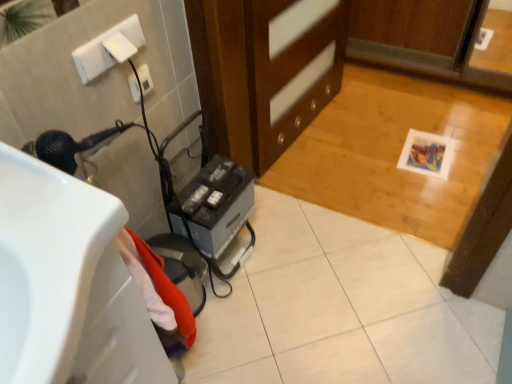
What do you see at coordinates (217, 204) in the screenshot? I see `metallic gray hair dryer at lower left` at bounding box center [217, 204].

You are a GUI agent. You are given a task and a screenshot of the screen. Output one action in this format:
    pyautogui.click(x=<x>, y=<y>)
    Task: Click on the metallic gray hair dryer at lower left
    The width and height of the screenshot is (512, 384).
    Given the screenshot: What is the action you would take?
    click(x=217, y=204)

In the image, is white plastic electric outlet at upper left positioned in front of or behind wooden cabinet at center?

Clearly, white plastic electric outlet at upper left is in front of wooden cabinet at center.

Considering the sizes of white plastic electric outlet at upper left and wooden cabinet at center in the image, is white plastic electric outlet at upper left wider or thinner than wooden cabinet at center?

Considering their sizes, white plastic electric outlet at upper left looks slimmer than wooden cabinet at center.

Considering the positions of point (141, 65) and point (244, 16), is point (141, 65) closer or farther from the camera than point (244, 16)?

Point (141, 65) is closer to the camera than point (244, 16).

How much distance is there between white plastic electric outlet at upper left and wooden cabinet at center?

white plastic electric outlet at upper left is 22.86 inches away from wooden cabinet at center.

From a real-world perspective, is white plastic electric outlet at upper left positioned above or below white glossy sink at lower left?

In terms of real-world spatial position, white plastic electric outlet at upper left is below white glossy sink at lower left.

Which point is more distant from viewer, [135,99] or [58,332]?

Positioned behind is point [135,99].

Which of these two, white plastic electric outlet at upper left or white glossy sink at lower left, is thinner?

white plastic electric outlet at upper left is thinner.

At what (x,y) coordinates should I click in order to perform the action: click on sink located on the left of white plastic electric outlet at upper left. Please return your answer as a coordinate pair (x, y). The width and height of the screenshot is (512, 384). Looking at the image, I should click on (68, 284).

Is metallic gray hair dryer at lower left looking in the opposite direction of white glossy sink at lower left?

No.

Which object is more forward, metallic gray hair dryer at lower left or white glossy sink at lower left?

white glossy sink at lower left is in front.

Between point (240, 175) and point (118, 263), which one is positioned in front?

Point (118, 263)

How much distance is there between metallic gray hair dryer at lower left and white glossy sink at lower left?

metallic gray hair dryer at lower left is 21.54 inches away from white glossy sink at lower left.

Which object is positioned more to the left, wooden cabinet at center or metallic gray hair dryer at lower left?

Positioned to the left is metallic gray hair dryer at lower left.

Does wooden cabinet at center touch metallic gray hair dryer at lower left?

No, wooden cabinet at center is not beside metallic gray hair dryer at lower left.

From the picture: From the image's perspective, is wooden cabinet at center above metallic gray hair dryer at lower left?

Correct, wooden cabinet at center appears higher than metallic gray hair dryer at lower left in the image.

Based on the photo, from the image's perspective, which is below, white glossy sink at lower left or metallic gray hair dryer at lower left?

white glossy sink at lower left is shown below in the image.

Looking at the image, does white glossy sink at lower left seem bigger or smaller compared to metallic gray hair dryer at lower left?

Considering their sizes, white glossy sink at lower left takes up more space than metallic gray hair dryer at lower left.

Does white glossy sink at lower left turn towards metallic gray hair dryer at lower left?

No, white glossy sink at lower left is not oriented towards metallic gray hair dryer at lower left.

Does white glossy sink at lower left contain metallic gray hair dryer at lower left?

No, white glossy sink at lower left does not contain metallic gray hair dryer at lower left.

Looking at this image, which is nearer, [10,372] or [335,36]?

Clearly, point [10,372] is closer to the camera than point [335,36].

From the image's perspective, which object appears higher, white glossy sink at lower left or wooden cabinet at center?

wooden cabinet at center.

Who is bigger, white glossy sink at lower left or wooden cabinet at center?

wooden cabinet at center is bigger.

From a real-world perspective, which object rests below the other?

wooden cabinet at center, from a real-world perspective.

Between white plastic electric outlet at upper left and metallic gray hair dryer at lower left, which one has larger width?

metallic gray hair dryer at lower left.

How many degrees apart are the facing directions of white plastic electric outlet at upper left and metallic gray hair dryer at lower left?

0.000417 degrees separate the facing orientations of white plastic electric outlet at upper left and metallic gray hair dryer at lower left.

Based on the photo, can you confirm if white plastic electric outlet at upper left is taller than metallic gray hair dryer at lower left?

No.

Identify the location of cabinetry behind the white plastic electric outlet at upper left. This screenshot has height=384, width=512. pos(258,75).

Find the location of `electric outlet above the white glossy sink at lower left (from the image's perspective)`. electric outlet above the white glossy sink at lower left (from the image's perspective) is located at coordinates (145, 79).

When comparing their distances from white glossy sink at lower left, does white plastic electric outlet at upper left or metallic gray hair dryer at lower left seem further?

Among the two, white plastic electric outlet at upper left is located further to white glossy sink at lower left.

Considering their positions, is white glossy sink at lower left positioned further to wooden cabinet at center than metallic gray hair dryer at lower left?

white glossy sink at lower left.

Estimate the real-world distances between objects in this image. Which object is closer to white plastic electric outlet at upper left, metallic gray hair dryer at lower left or white glossy sink at lower left?

metallic gray hair dryer at lower left is closer to white plastic electric outlet at upper left.

Which object lies nearer to the anchor point metallic gray hair dryer at lower left, white plastic electric outlet at upper left or wooden cabinet at center?

Among the two, wooden cabinet at center is located nearer to metallic gray hair dryer at lower left.

Based on their spatial positions, is wooden cabinet at center or white glossy sink at lower left closer to white plastic electric outlet at upper left?

wooden cabinet at center.

Considering their positions, is wooden cabinet at center positioned further to white glossy sink at lower left than white plastic electric outlet at upper left?

wooden cabinet at center lies further to white glossy sink at lower left than the other object.

Which object lies nearer to the anchor point wooden cabinet at center, metallic gray hair dryer at lower left or white glossy sink at lower left?

metallic gray hair dryer at lower left lies closer to wooden cabinet at center than the other object.

Estimate the real-world distances between objects in this image. Which object is closer to white glossy sink at lower left, metallic gray hair dryer at lower left or wooden cabinet at center?

Based on the image, metallic gray hair dryer at lower left appears to be nearer to white glossy sink at lower left.

Locate an element on the screen. This screenshot has width=512, height=384. electric outlet positioned between white glossy sink at lower left and wooden cabinet at center from near to far is located at coordinates (145, 79).

The height and width of the screenshot is (384, 512). Identify the location of electric outlet between white glossy sink at lower left and metallic gray hair dryer at lower left from front to back. (145, 79).

This screenshot has height=384, width=512. In order to click on appliance between white glossy sink at lower left and wooden cabinet at center from front to back in this screenshot , I will do click(217, 204).

At what (x,y) coordinates should I click in order to perform the action: click on electric outlet between wooden cabinet at center and metallic gray hair dryer at lower left vertically. Please return your answer as a coordinate pair (x, y). The width and height of the screenshot is (512, 384). Looking at the image, I should click on (145, 79).